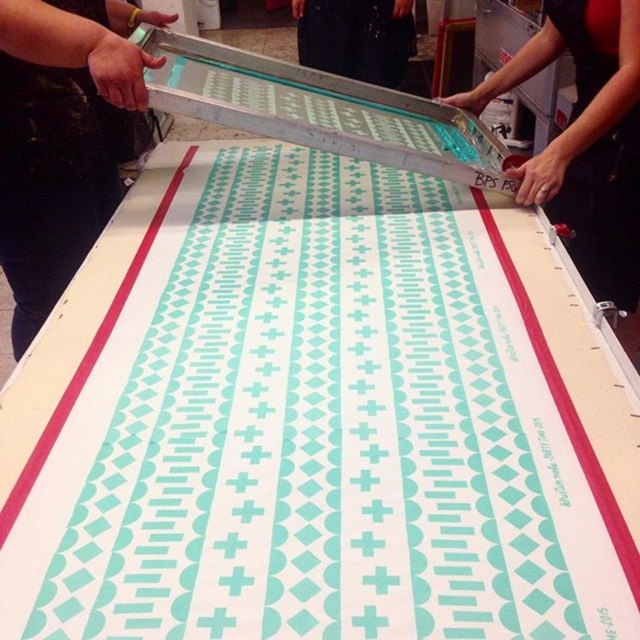
Can you confirm if black fabric at upper left is thinner than black fabric at center?

No.

Can you confirm if black fabric at upper left is shorter than black fabric at center?

In fact, black fabric at upper left may be taller than black fabric at center.

Does point (13, 253) come in front of point (362, 3)?

That is True.

At what (x,y) coordinates should I click in order to perform the action: click on black fabric at upper left. Please return your answer as a coordinate pair (x, y). Looking at the image, I should click on (60, 138).

Can you confirm if metallic silver tool at upper center is positioned below black fabric at center?

Yes.

Between metallic silver tool at upper center and black fabric at center, which one is positioned higher?

black fabric at center

Between point (611, 65) and point (394, 12), which one is positioned in front?

Positioned in front is point (611, 65).

Where is `metallic silver tool at upper center`? The height and width of the screenshot is (640, 640). metallic silver tool at upper center is located at coordinates coord(586,140).

Is black fabric at upper left taller than metallic silver tool at upper center?

Yes.

Does black fabric at upper left appear under metallic silver tool at upper center?

Yes, black fabric at upper left is below metallic silver tool at upper center.

The image size is (640, 640). What do you see at coordinates (60, 138) in the screenshot?
I see `black fabric at upper left` at bounding box center [60, 138].

Identify the location of black fabric at upper left. The image size is (640, 640). (60, 138).